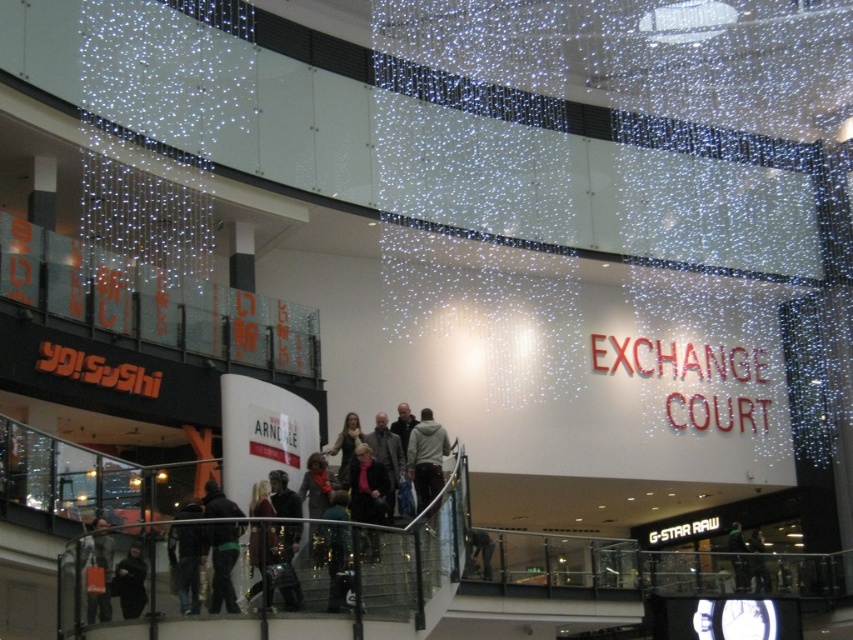
Question: Does light gray hoodie at center have a lesser width compared to dark gray jacket at center?

Choices:
 (A) yes
 (B) no

Answer: (A)

Question: Which object is the farthest from the dark gray fabric jacket at lower center?

Choices:
 (A) dark gray sweater at center
 (B) dark gray jacket at center
 (C) black fabric coat at lower left

Answer: (B)

Question: Does dark blue jeans at lower left lie behind dark gray jacket at center?

Choices:
 (A) yes
 (B) no

Answer: (B)

Question: Which object is the closest to the dark gray jacket at lower left?

Choices:
 (A) dark gray jacket at center
 (B) black fabric coat at lower left
 (C) light gray hoodie at center
 (D) dark brown leather jacket at center

Answer: (B)

Question: Which object is closer to the camera taking this photo?

Choices:
 (A) dark brown leather jacket at center
 (B) light gray hoodie at center
 (C) dark gray jacket at center

Answer: (A)

Question: Can you confirm if dark gray jacket at lower left is positioned to the right of dark gray fabric jacket at lower left?

Choices:
 (A) yes
 (B) no

Answer: (A)